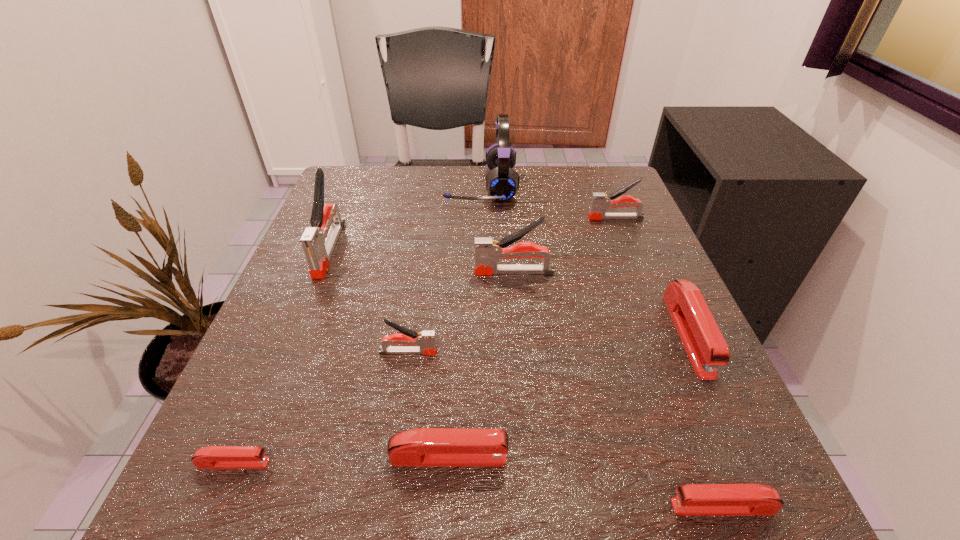
This screenshot has height=540, width=960. What are the coordinates of `vacant area at the left edge of the desktop` in the screenshot? It's located at (276, 354).

At what (x,y) coordinates should I click in order to perform the action: click on vacant region at the far left corner. Please return your answer as a coordinate pair (x, y). Looking at the image, I should click on (360, 218).

Identify the location of blank space at the near left corner of the desktop. The height and width of the screenshot is (540, 960). (325, 455).

The image size is (960, 540). I want to click on vacant area at the far right corner of the desktop, so click(616, 185).

Identify the location of free location at the near right corner. This screenshot has width=960, height=540. (676, 517).

Locate an element on the screen. free spot between the biggest gray stapler and the rightmost gray stapler is located at coordinates (472, 233).

You are a GUI agent. You are given a task and a screenshot of the screen. Output one action in this format:
    pyautogui.click(x=<x>, y=<y>)
    Task: Click on the vacant space that's between the biggest gray stapler and the eighth tallest object
    This screenshot has width=960, height=540.
    Given the screenshot: What is the action you would take?
    (526, 378)

The height and width of the screenshot is (540, 960). Identify the location of free area in between the eighth tallest object and the second gray stapler from left to right. (565, 429).

The image size is (960, 540). I want to click on vacant area that lies between the nearest object and the biggest gray stapler, so click(526, 378).

The height and width of the screenshot is (540, 960). What are the coordinates of `free space between the third smallest red stapler and the leftmost red stapler` in the screenshot? It's located at (342, 460).